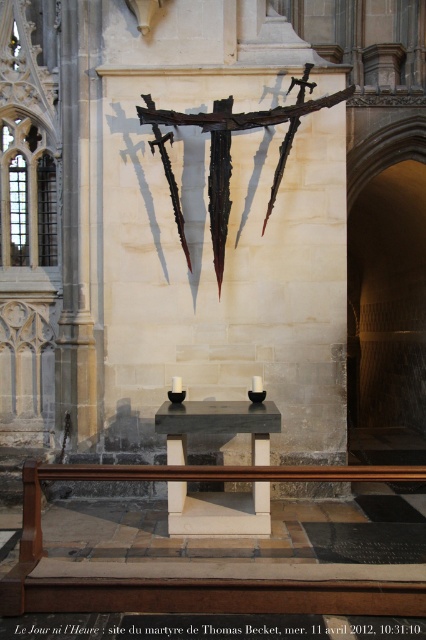
Who is more forward, (181, 440) or (222, 113)?

Point (181, 440)

Is point (160, 413) positioned before point (293, 76)?

Yes, point (160, 413) is in front of point (293, 76).

Does point (186, 460) lie in front of point (226, 122)?

Yes, point (186, 460) is closer to viewer.

Where is `black polished stone altar at center`? black polished stone altar at center is located at coordinates (218, 424).